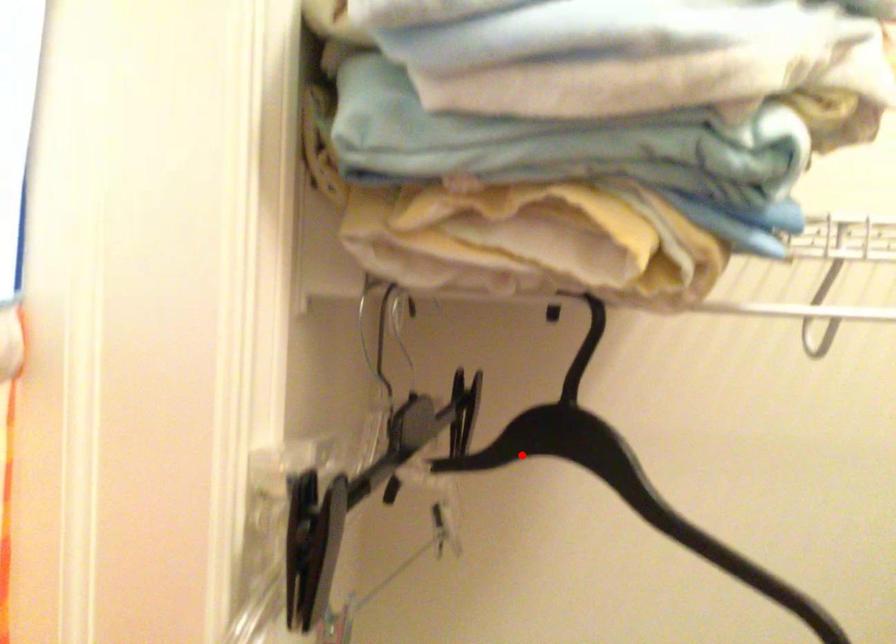
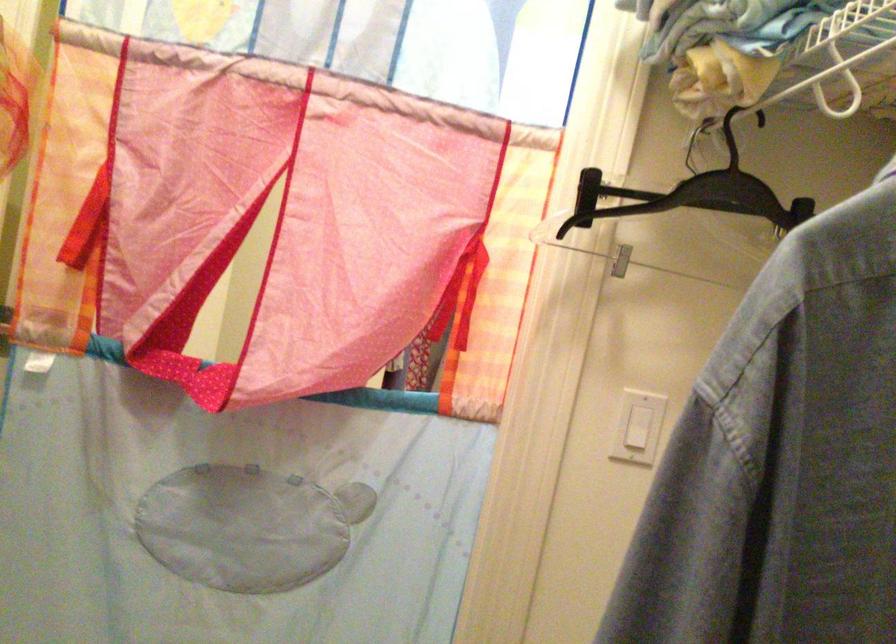
Locate, in the second image, the point that corresponds to the highlighted location in the first image.

(693, 194)